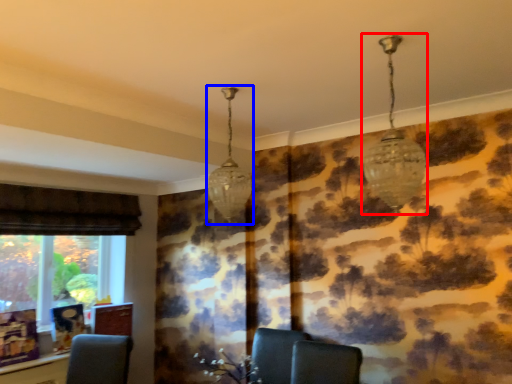
Question: Which point is further to the camera, lamp (highlighted by a red box) or lamp (highlighted by a blue box)?

Choices:
 (A) lamp
 (B) lamp

Answer: (B)